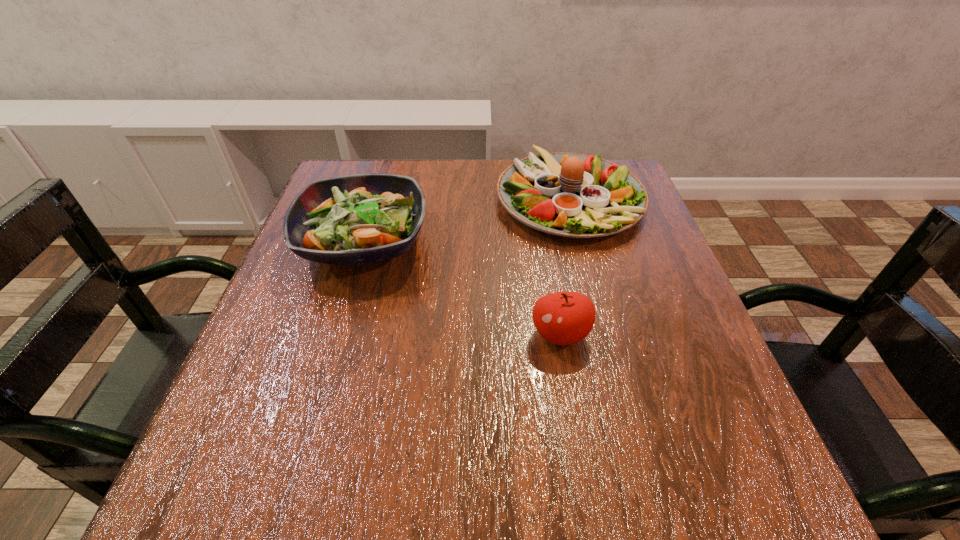
Locate an element on the screen. This screenshot has height=540, width=960. the right salad plate is located at coordinates (573, 195).

Identify the location of the left salad plate. The height and width of the screenshot is (540, 960). (354, 219).

The image size is (960, 540). In order to click on the nearest object in this screenshot , I will do `click(563, 318)`.

Identify the location of vacant space located 0.150m on the left of the right salad plate. The height and width of the screenshot is (540, 960). (436, 199).

The width and height of the screenshot is (960, 540). What are the coordinates of `vacant space located 0.280m on the front of the leftmost object` in the screenshot? It's located at pyautogui.click(x=311, y=418).

I want to click on blank area located 0.130m on the front of the apple, so click(575, 427).

Where is `object located in the left edge section of the desktop`? object located in the left edge section of the desktop is located at coordinates (354, 219).

Where is `object that is at the right edge`? The height and width of the screenshot is (540, 960). object that is at the right edge is located at coordinates (573, 195).

What are the coordinates of `object positioned at the far left corner` in the screenshot? It's located at (354, 219).

Identify the location of object that is at the far right corner. Image resolution: width=960 pixels, height=540 pixels. (573, 195).